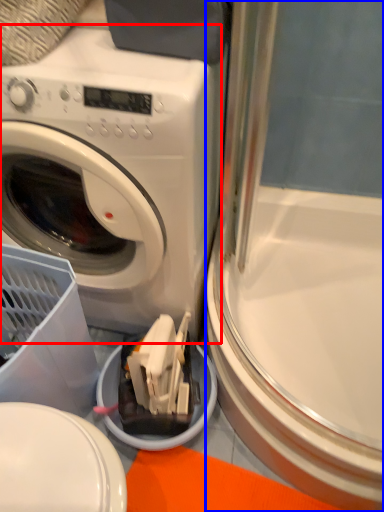
Question: Which object is closer to the camera taking this photo, washing machine (highlighted by a red box) or screen door (highlighted by a blue box)?

Choices:
 (A) washing machine
 (B) screen door

Answer: (A)